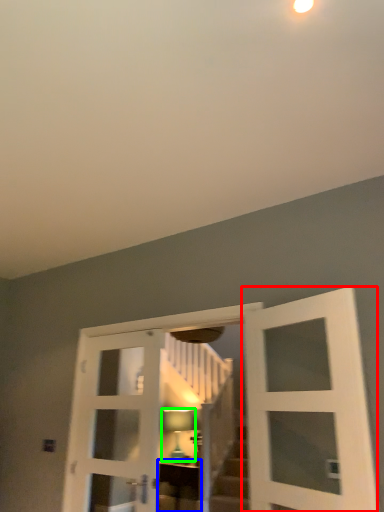
Question: Considering the real-world distances, which object is closest to door (highlighted by a red box)? furniture (highlighted by a blue box) or light fixture (highlighted by a green box).

Choices:
 (A) furniture
 (B) light fixture

Answer: (A)